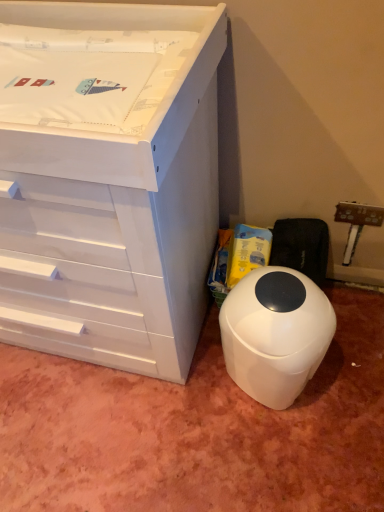
Find the location of `vacant area that is in front of white glossy chest of drawers at upper left`. vacant area that is in front of white glossy chest of drawers at upper left is located at coordinates (118, 432).